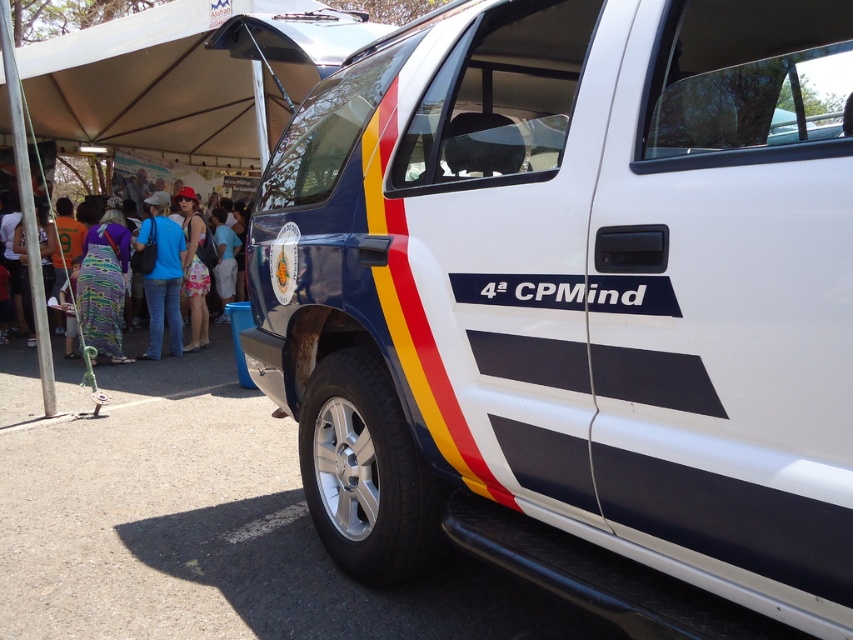
Question: Which of these objects is positioned closest to the printed fabric dress at left?

Choices:
 (A) blue jeans at center
 (B) white glossy police van at center

Answer: (A)

Question: Which object appears farthest from the camera in this image?

Choices:
 (A) blue jeans at center
 (B) printed fabric dress at left

Answer: (B)

Question: Among these points, which one is farthest from the camera?

Choices:
 (A) (79, 177)
 (B) (151, 296)

Answer: (A)

Question: Observing the image, what is the correct spatial positioning of blue jeans at center in reference to printed fabric dress at left?

Choices:
 (A) left
 (B) right

Answer: (B)

Question: Where is white glossy police van at center located in relation to printed fabric dress at left in the image?

Choices:
 (A) above
 (B) below

Answer: (B)

Question: Can you confirm if blue jeans at center is bigger than printed fabric dress at left?

Choices:
 (A) no
 (B) yes

Answer: (B)